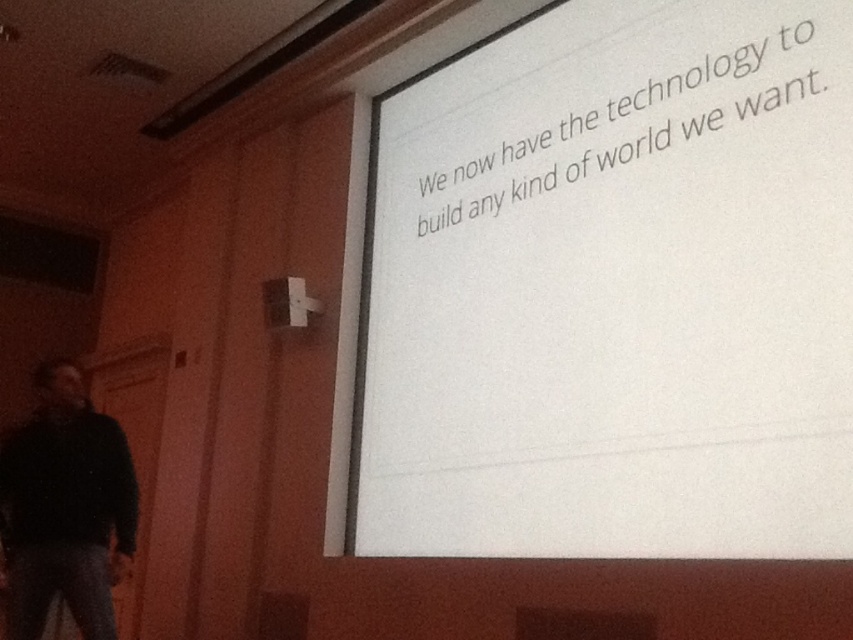
Between white paper at upper center and black matte jacket at lower left, which one is positioned higher?

white paper at upper center is higher up.

Which is behind, point (593, 280) or point (65, 452)?

Positioned behind is point (65, 452).

Which is in front, point (602, 481) or point (56, 506)?

Positioned in front is point (602, 481).

Identify the location of white paper at upper center. (613, 291).